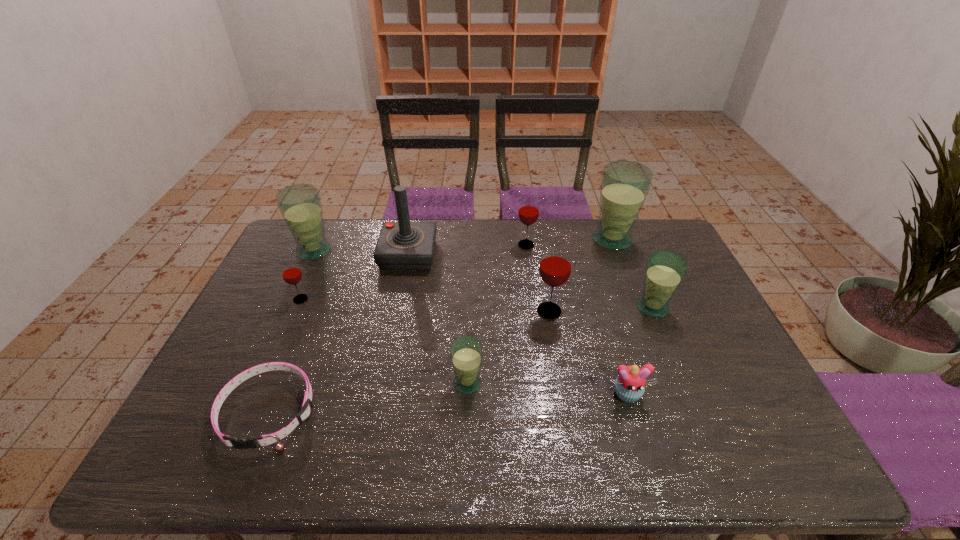
The image size is (960, 540). I want to click on vacant region that satisfies the following two spatial constraints: 1. on the back side of the second smallest blue glass; 2. on the right side of the nearest blue glass, so click(x=469, y=307).